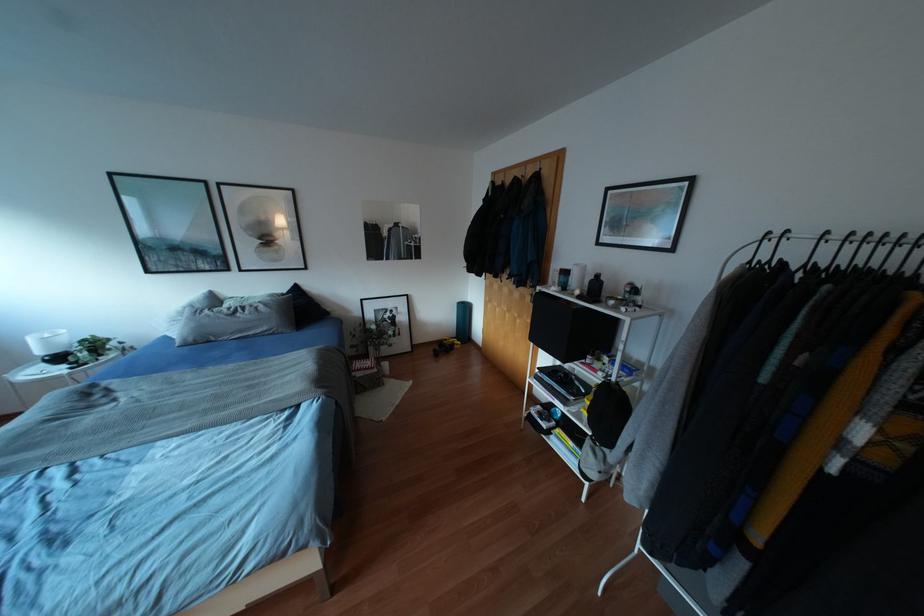
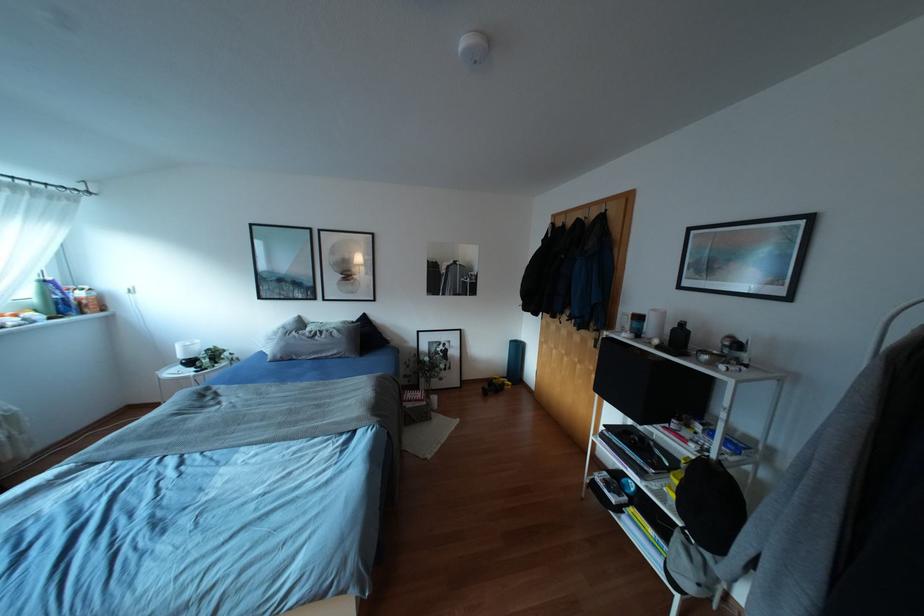
Locate, in the second image, the point that corresponds to (597,276) in the first image.

(682, 323)